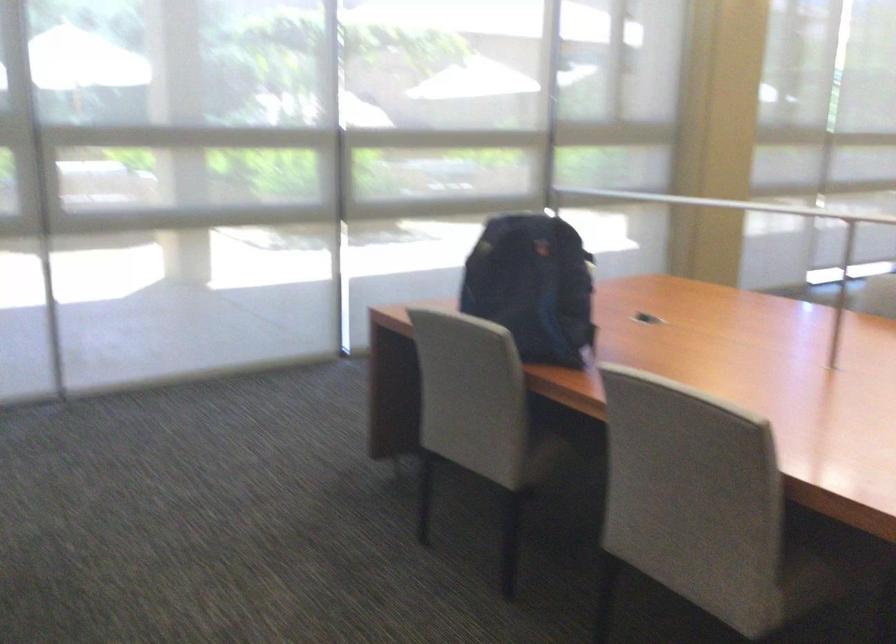
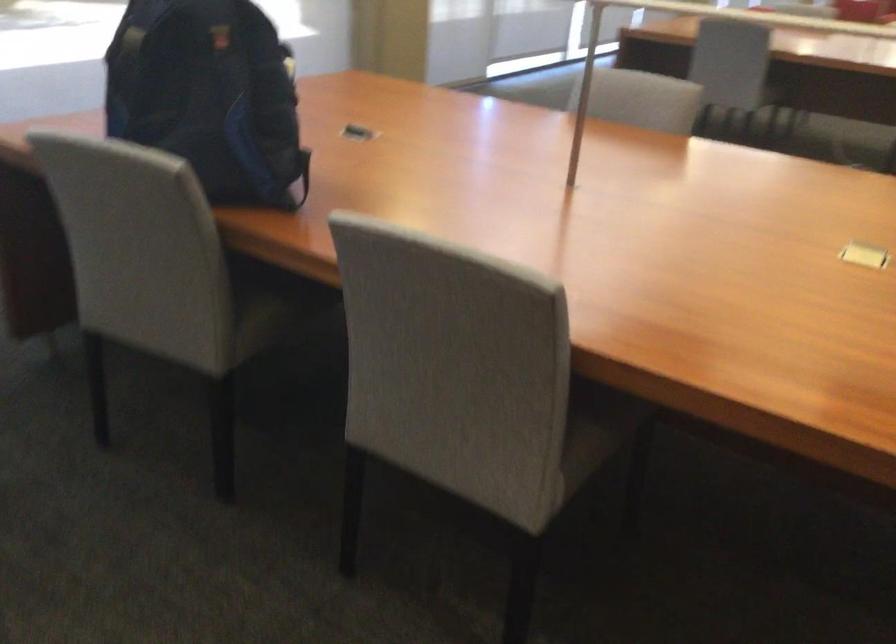
Question: The first image is from the beginning of the video and the second image is from the end. How did the camera likely rotate when shooting the video?

Choices:
 (A) Left
 (B) Right
 (C) Up
 (D) Down

Answer: (B)